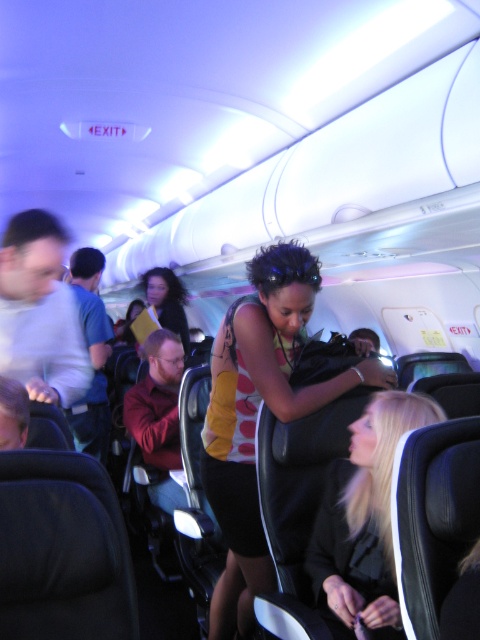
Question: Does yellow sleeveless top at center have a smaller size compared to black leather jacket at lower right?

Choices:
 (A) yes
 (B) no

Answer: (B)

Question: Which point appears farthest from the camera in this image?

Choices:
 (A) click(x=141, y=403)
 (B) click(x=156, y=273)

Answer: (B)

Question: Which object appears farthest from the camera in this image?

Choices:
 (A) black leather jacket at lower right
 (B) maroon fabric shirt at center
 (C) yellow sleeveless top at center

Answer: (B)

Question: Observing the image, what is the correct spatial positioning of yellow sleeveless top at center in reference to blue fabric shirt at left?

Choices:
 (A) left
 (B) right

Answer: (B)

Question: Is yellow sleeveless top at center further to camera compared to matte yellow jacket at center?

Choices:
 (A) no
 (B) yes

Answer: (A)

Question: Which object appears closest to the camera in this image?

Choices:
 (A) black leather jacket at lower right
 (B) yellow sleeveless top at center
 (C) matte yellow jacket at center
 (D) maroon fabric shirt at center

Answer: (A)